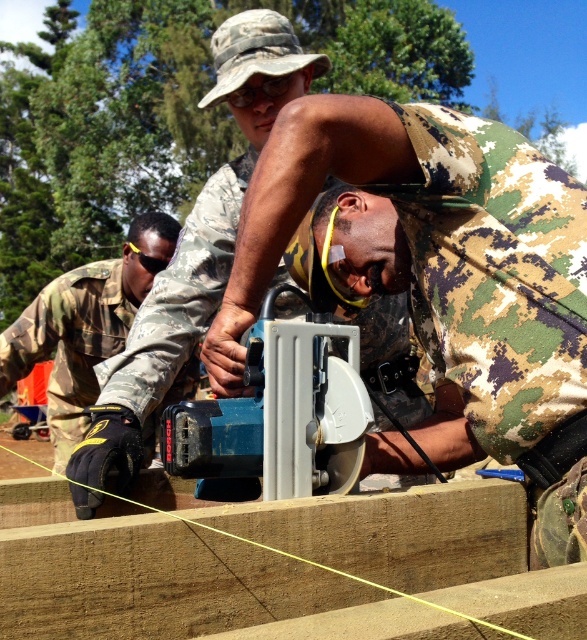
Is camouflage fabric at center to the left of camo fabric man at center from the viewer's perspective?

No, camouflage fabric at center is not to the left of camo fabric man at center.

Does point (582, 397) come in front of point (194, 234)?

Yes, point (582, 397) is closer to viewer.

Between point (518, 445) and point (156, 385), which one is positioned behind?

The point (156, 385) is behind.

Image resolution: width=587 pixels, height=640 pixels. Find the location of `camouflage fabric at center`. camouflage fabric at center is located at coordinates (430, 259).

Measure the distance between camouflage fabric at center and blue plastic saw at center.

camouflage fabric at center and blue plastic saw at center are 6.21 inches apart from each other.

Does camouflage fabric at center appear on the left side of blue plastic saw at center?

In fact, camouflage fabric at center is to the right of blue plastic saw at center.

Between point (504, 202) and point (299, 484), which one is positioned behind?

Point (504, 202)

What are the coordinates of `camouflage fabric at center` in the screenshot? It's located at (430, 259).

Is brown wood plank at center further to camera compared to blue plastic saw at center?

That is False.

Does brown wood plank at center appear on the left side of blue plastic saw at center?

No, brown wood plank at center is not to the left of blue plastic saw at center.

Describe the element at coordinates (153, 580) in the screenshot. This screenshot has width=587, height=640. I see `brown wood plank at center` at that location.

The width and height of the screenshot is (587, 640). What are the coordinates of `brown wood plank at center` in the screenshot? It's located at (153, 580).